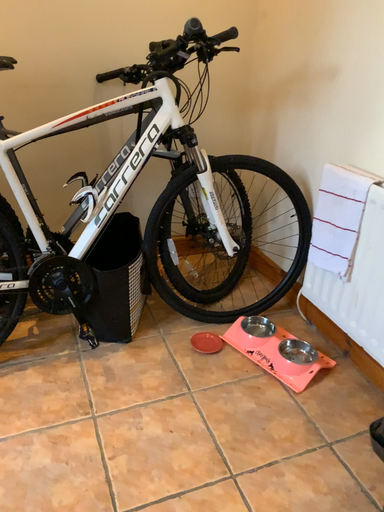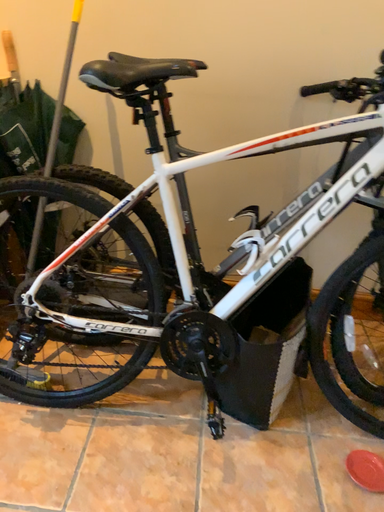
Question: How did the camera likely rotate when shooting the video?

Choices:
 (A) rotated right
 (B) rotated left

Answer: (B)